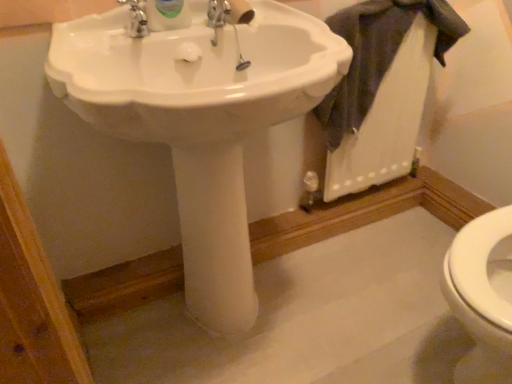
Question: From the image's perspective, would you say white glossy sink at center is positioned over dark gray fabric at upper right?

Choices:
 (A) yes
 (B) no

Answer: (B)

Question: Is white glossy sink at center wider than dark gray fabric at upper right?

Choices:
 (A) yes
 (B) no

Answer: (A)

Question: Is dark gray fabric at upper right located within white glossy sink at center?

Choices:
 (A) yes
 (B) no

Answer: (B)

Question: Can you confirm if white glossy sink at center is smaller than dark gray fabric at upper right?

Choices:
 (A) no
 (B) yes

Answer: (A)

Question: Would you say white glossy sink at center is a long distance from dark gray fabric at upper right?

Choices:
 (A) yes
 (B) no

Answer: (B)

Question: From a real-world perspective, is white glossy sink at center physically below dark gray fabric at upper right?

Choices:
 (A) no
 (B) yes

Answer: (B)

Question: Is dark gray fabric at upper right shorter than white glossy sink at center?

Choices:
 (A) no
 (B) yes

Answer: (B)

Question: Is dark gray fabric at upper right smaller than white glossy sink at center?

Choices:
 (A) no
 (B) yes

Answer: (B)

Question: Is dark gray fabric at upper right taller than white glossy sink at center?

Choices:
 (A) no
 (B) yes

Answer: (A)

Question: Is the depth of dark gray fabric at upper right less than that of white glossy sink at center?

Choices:
 (A) yes
 (B) no

Answer: (B)

Question: Does dark gray fabric at upper right have a larger size compared to white glossy sink at center?

Choices:
 (A) no
 (B) yes

Answer: (A)

Question: From a real-world perspective, does dark gray fabric at upper right sit lower than white glossy sink at center?

Choices:
 (A) yes
 (B) no

Answer: (B)

Question: In terms of width, does white glossy sink at center look wider or thinner when compared to dark gray fabric at upper right?

Choices:
 (A) thin
 (B) wide

Answer: (B)